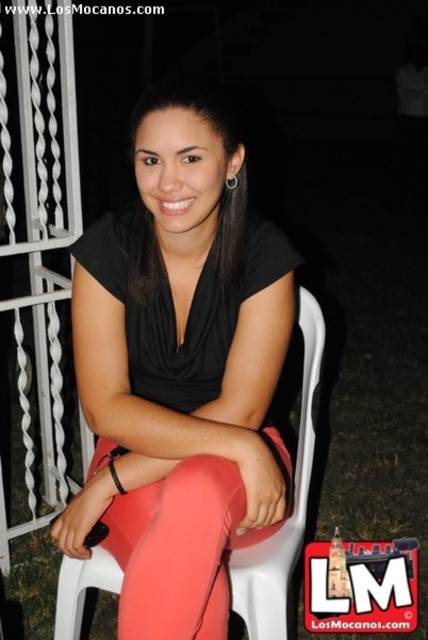
Does matte black top at center appear on the right side of matte pink leggings at center?

Yes, matte black top at center is to the right of matte pink leggings at center.

Is point (145, 193) in front of point (243, 536)?

That is True.

Does point (285, 289) come farther from viewer compared to point (243, 536)?

Yes, it is behind point (243, 536).

Where is `matte black top at center`? matte black top at center is located at coordinates (181, 371).